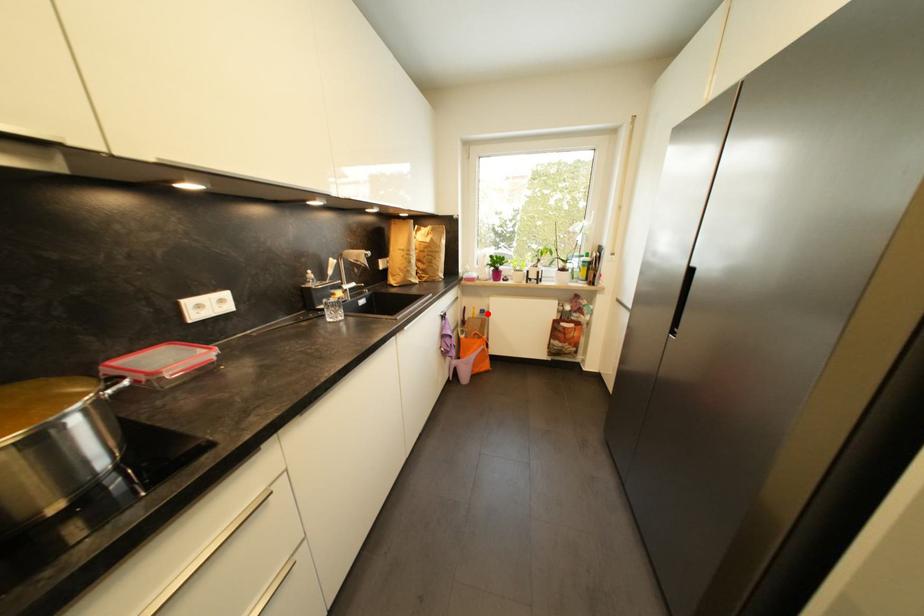
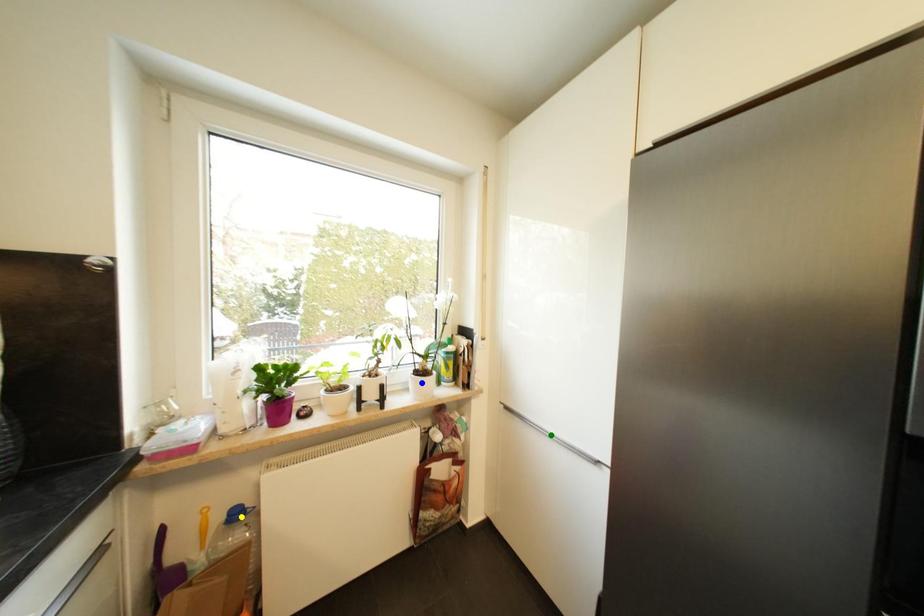
Question: I am providing you with two images of the same scene from different viewpoints. A red point is marked on the first image. You are given multiple points on the second image. Which point in image 2 is actually the same real-world point as the red point in image 1?

Choices:
 (A) green point
 (B) yellow point
 (C) blue point

Answer: (B)